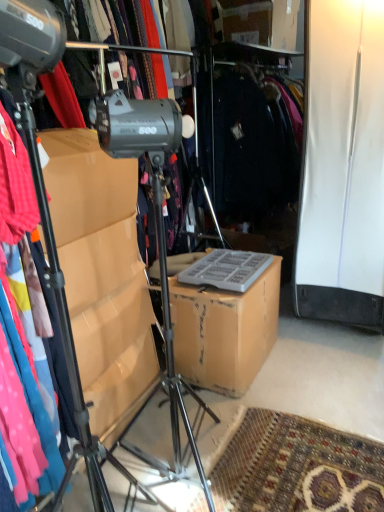
Question: From the image's perspective, is metallic tripod at left below brown cardboard box at center?

Choices:
 (A) no
 (B) yes

Answer: (A)

Question: Can you confirm if metallic tripod at left is smaller than brown cardboard box at center?

Choices:
 (A) yes
 (B) no

Answer: (B)

Question: Considering the relative positions of metallic tripod at left and brown cardboard box at center in the image provided, is metallic tripod at left to the left of brown cardboard box at center from the viewer's perspective?

Choices:
 (A) no
 (B) yes

Answer: (B)

Question: Considering the relative sizes of metallic tripod at left and brown cardboard box at center in the image provided, is metallic tripod at left shorter than brown cardboard box at center?

Choices:
 (A) yes
 (B) no

Answer: (B)

Question: Is metallic tripod at left next to brown cardboard box at center and touching it?

Choices:
 (A) no
 (B) yes

Answer: (A)

Question: Is brown cardboard box at center at the back of metallic tripod at left?

Choices:
 (A) no
 (B) yes

Answer: (A)

Question: Does brown cardboard box at center contain metallic tripod at left?

Choices:
 (A) no
 (B) yes

Answer: (A)

Question: Can you see brown cardboard box at center touching metallic tripod at left?

Choices:
 (A) no
 (B) yes

Answer: (A)

Question: Does brown cardboard box at center have a greater height compared to metallic tripod at left?

Choices:
 (A) no
 (B) yes

Answer: (A)

Question: Can you confirm if brown cardboard box at center is thinner than metallic tripod at left?

Choices:
 (A) no
 (B) yes

Answer: (B)

Question: Does brown cardboard box at center have a larger size compared to metallic tripod at left?

Choices:
 (A) yes
 (B) no

Answer: (B)

Question: From a real-world perspective, is brown cardboard box at center below metallic tripod at left?

Choices:
 (A) yes
 (B) no

Answer: (A)

Question: Is metallic tripod at left to the left or to the right of brown cardboard box at center in the image?

Choices:
 (A) left
 (B) right

Answer: (A)